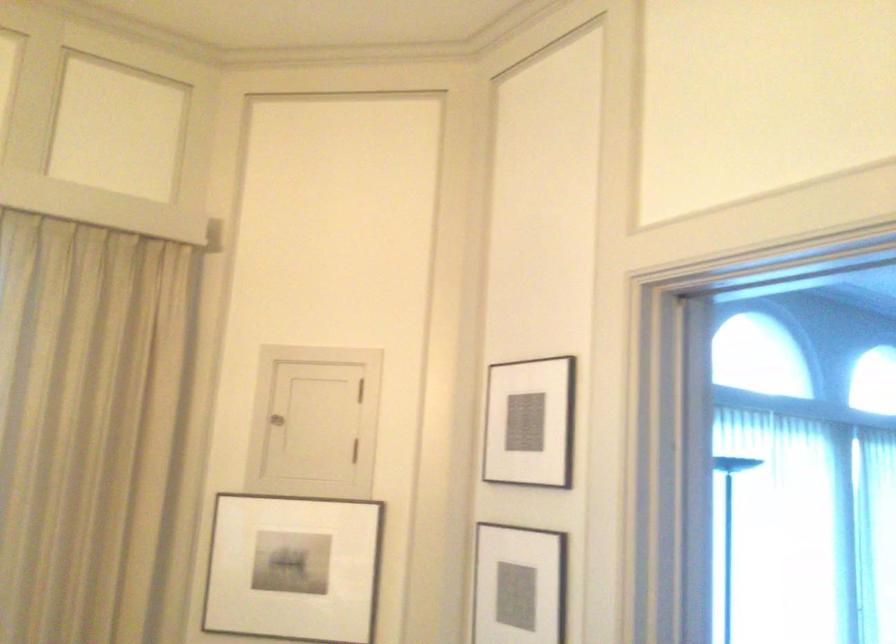
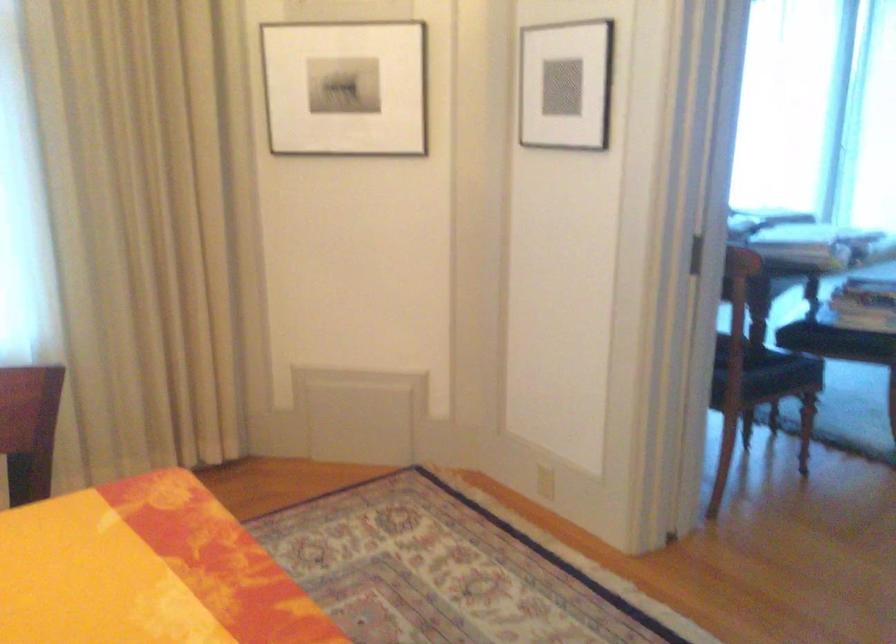
Question: The images are taken continuously from a first-person perspective. In which direction is your viewpoint rotating?

Choices:
 (A) Left
 (B) Right
 (C) Up
 (D) Down

Answer: (D)